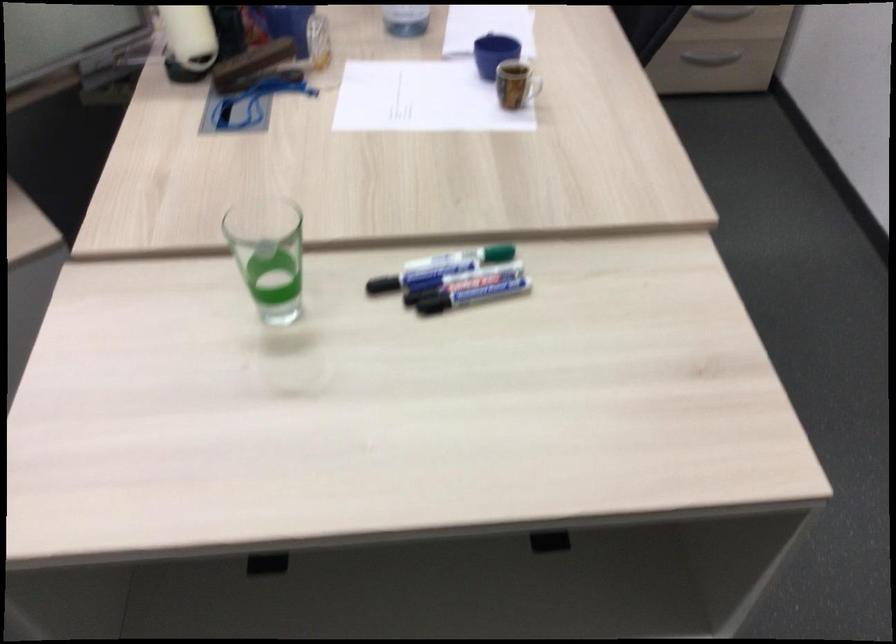
Where is `silver drawer handle`? The height and width of the screenshot is (644, 896). silver drawer handle is located at coordinates (708, 61).